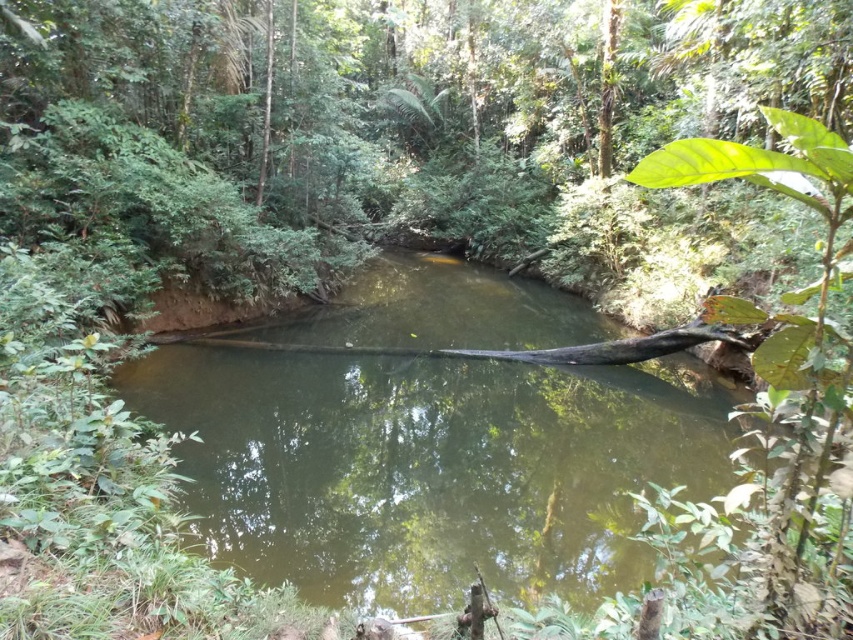
Question: Which point is closer to the camera?

Choices:
 (A) green murky water at center
 (B) brown wood log at center

Answer: (A)

Question: Can you confirm if green murky water at center is thinner than brown wood log at center?

Choices:
 (A) yes
 (B) no

Answer: (A)

Question: Among these points, which one is nearest to the camera?

Choices:
 (A) (610, 353)
 (B) (685, 481)

Answer: (B)

Question: Does green murky water at center have a smaller size compared to brown wood log at center?

Choices:
 (A) yes
 (B) no

Answer: (B)

Question: Which object appears closest to the camera in this image?

Choices:
 (A) brown wood log at center
 (B) green murky water at center

Answer: (B)

Question: Can you confirm if green murky water at center is thinner than brown wood log at center?

Choices:
 (A) yes
 (B) no

Answer: (A)